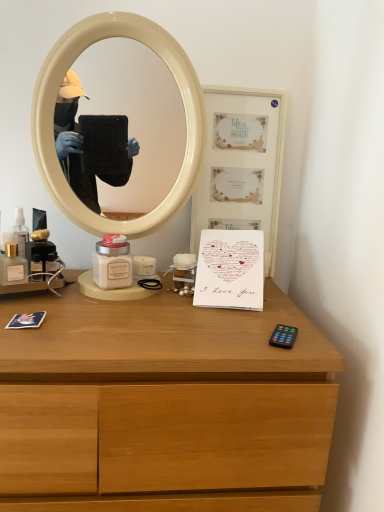
Image resolution: width=384 pixels, height=512 pixels. What are the coordinates of `free space above wooden at lower right (from a real-world perspective)` in the screenshot? It's located at (130, 306).